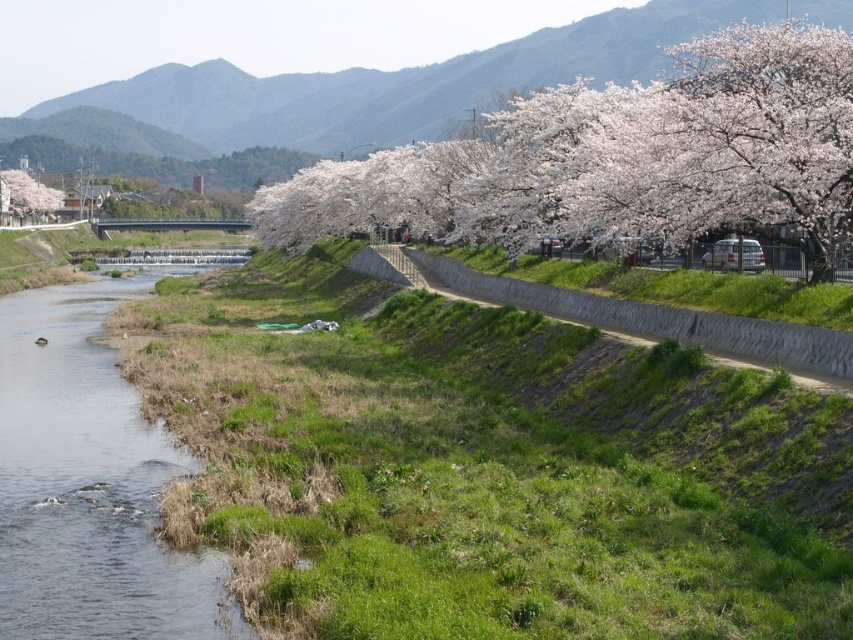
Consider the image. Is clear water at river left closer to camera compared to cherry blossom tree at upper left?

Yes, clear water at river left is in front of cherry blossom tree at upper left.

Can you confirm if clear water at river left is positioned above cherry blossom tree at upper left?

Incorrect, clear water at river left is not positioned above cherry blossom tree at upper left.

Measure the distance between point (120,481) and camera.

Point (120,481) is 71.02 feet from camera.

Locate an element on the screen. The width and height of the screenshot is (853, 640). clear water at river left is located at coordinates click(90, 484).

Is white blossoming tree at upper right above cherry blossom tree at upper left?

Correct, white blossoming tree at upper right is located above cherry blossom tree at upper left.

From the picture: Which is more to the left, white blossoming tree at upper right or cherry blossom tree at upper left?

From the viewer's perspective, cherry blossom tree at upper left appears more on the left side.

Is point (700, 180) in front of point (44, 186)?

Yes, it is.

Locate an element on the screen. white blossoming tree at upper right is located at coordinates (619, 157).

Consider the image. Can you confirm if white blossoming tree at upper right is shorter than clear water at river left?

In fact, white blossoming tree at upper right may be taller than clear water at river left.

The image size is (853, 640). What do you see at coordinates (619, 157) in the screenshot?
I see `white blossoming tree at upper right` at bounding box center [619, 157].

Is point (850, 186) more distant than point (219, 593)?

Yes, point (850, 186) is behind point (219, 593).

The image size is (853, 640). Find the location of `white blossoming tree at upper right`. white blossoming tree at upper right is located at coordinates (619, 157).